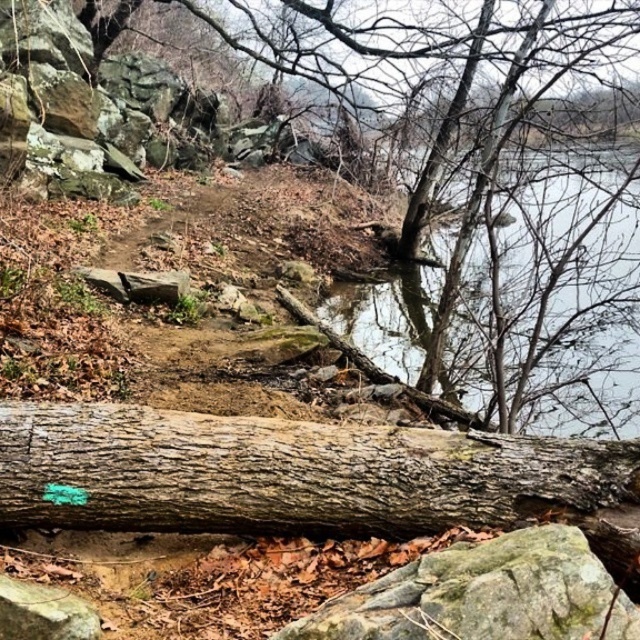
Question: Where is clear water at center located in relation to green mossy rock at lower center in the image?

Choices:
 (A) left
 (B) right

Answer: (B)

Question: Which of the following is the farthest from the observer?

Choices:
 (A) clear water at center
 (B) green mossy rock at lower center

Answer: (A)

Question: Does clear water at center appear on the right side of green mossy rock at lower center?

Choices:
 (A) yes
 (B) no

Answer: (A)

Question: Is clear water at center positioned before green mossy rock at lower center?

Choices:
 (A) yes
 (B) no

Answer: (B)